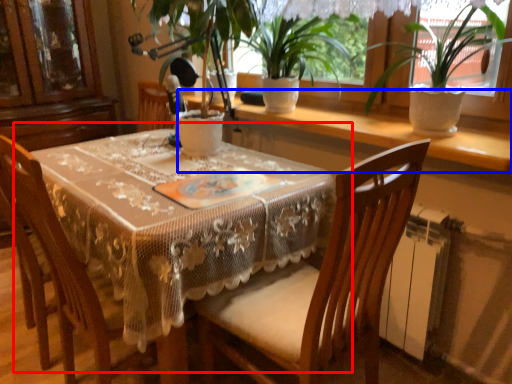
Question: Which of the following is the closest to the observer, table (highlighted by a red box) or window sill (highlighted by a blue box)?

Choices:
 (A) table
 (B) window sill

Answer: (A)